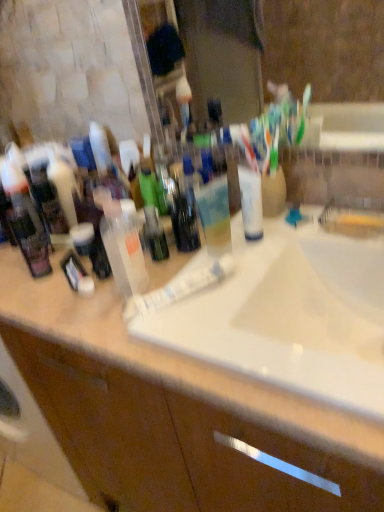
Image resolution: width=384 pixels, height=512 pixels. I want to click on vacant space to the right of white plastic tube at center, so click(313, 244).